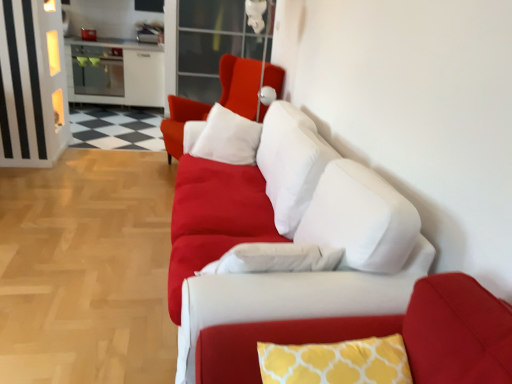
Question: Is yellow printed cushion at center at the right side of transparent glass door at upper center?

Choices:
 (A) no
 (B) yes

Answer: (B)

Question: Can transparent glass door at upper center be found inside yellow printed cushion at center?

Choices:
 (A) yes
 (B) no

Answer: (B)

Question: Can you confirm if yellow printed cushion at center is thinner than transparent glass door at upper center?

Choices:
 (A) no
 (B) yes

Answer: (B)

Question: Can you confirm if yellow printed cushion at center is taller than transparent glass door at upper center?

Choices:
 (A) no
 (B) yes

Answer: (A)

Question: Are yellow printed cushion at center and transparent glass door at upper center located far from each other?

Choices:
 (A) yes
 (B) no

Answer: (A)

Question: Does point (202, 299) appear closer or farther from the camera than point (72, 61)?

Choices:
 (A) closer
 (B) farther

Answer: (A)

Question: Is matte white couch at center inside the boundaries of white glossy cabinet at upper left, or outside?

Choices:
 (A) outside
 (B) inside

Answer: (A)

Question: From a real-world perspective, relative to white glossy cabinet at upper left, is matte white couch at center vertically above or below?

Choices:
 (A) above
 (B) below

Answer: (A)

Question: Looking at their shapes, would you say matte white couch at center is wider or thinner than white glossy cabinet at upper left?

Choices:
 (A) thin
 (B) wide

Answer: (B)

Question: In terms of width, does yellow printed cushion at center look wider or thinner when compared to matte white cushion at center?

Choices:
 (A) thin
 (B) wide

Answer: (A)

Question: Would you say yellow printed cushion at center is inside or outside matte white cushion at center?

Choices:
 (A) inside
 (B) outside

Answer: (B)

Question: In terms of size, does yellow printed cushion at center appear bigger or smaller than matte white cushion at center?

Choices:
 (A) big
 (B) small

Answer: (B)

Question: In the image, is yellow printed cushion at center positioned in front of or behind matte white cushion at center?

Choices:
 (A) behind
 (B) front

Answer: (B)

Question: Do you think white glossy cabinet at upper left is within matte white cushion at center, or outside of it?

Choices:
 (A) inside
 (B) outside

Answer: (B)

Question: Visually, is white glossy cabinet at upper left positioned to the left or to the right of matte white cushion at center?

Choices:
 (A) right
 (B) left

Answer: (B)